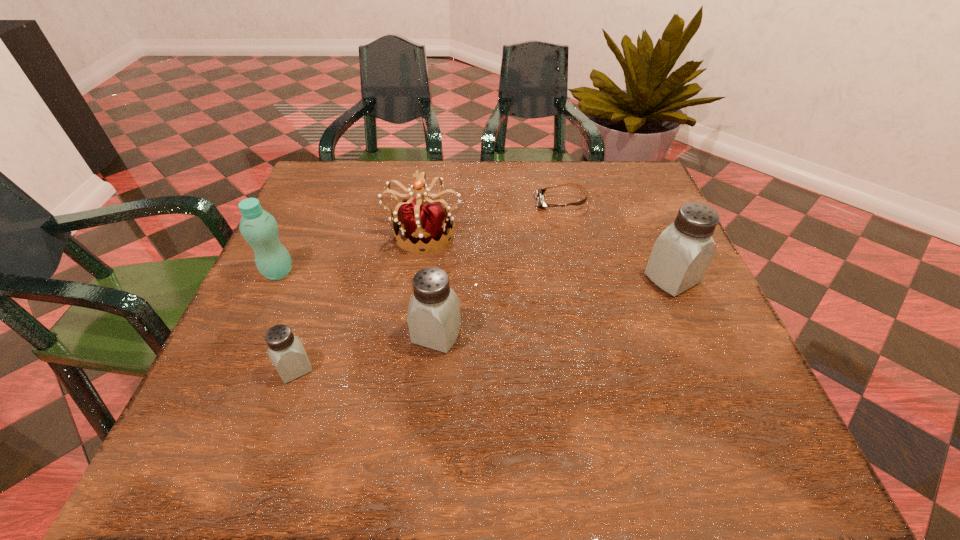
Locate an element on the screen. vacant space at the far right corner of the desktop is located at coordinates 640,177.

Locate an element on the screen. The width and height of the screenshot is (960, 540). vacant space at the near right corner is located at coordinates (745, 404).

This screenshot has width=960, height=540. I want to click on unoccupied position between the tiara and the fifth tallest object, so click(x=360, y=300).

The width and height of the screenshot is (960, 540). I want to click on unoccupied position between the bottle and the fifth tallest object, so click(287, 320).

You are a GUI agent. You are given a task and a screenshot of the screen. Output one action in this format:
    pyautogui.click(x=<x>, y=<y>)
    Task: Click on the free space between the second tallest saltshaker and the fifth object from right to left
    
    Given the screenshot: What is the action you would take?
    pyautogui.click(x=366, y=352)

The image size is (960, 540). Find the location of `free space between the second object from right to left and the rightmost saltshaker`. free space between the second object from right to left and the rightmost saltshaker is located at coordinates (616, 240).

This screenshot has height=540, width=960. Find the location of `free point between the second saltshaker from right to left and the rightmost object`. free point between the second saltshaker from right to left and the rightmost object is located at coordinates (554, 307).

Find the location of a particular element. Image resolution: width=960 pixels, height=540 pixels. free space between the leftmost object and the rightmost object is located at coordinates (475, 275).

Locate an element on the screen. The width and height of the screenshot is (960, 540). blank region between the leftmost object and the leftmost saltshaker is located at coordinates (287, 320).

I want to click on blank region between the rightmost saltshaker and the fifth object from left to right, so click(x=616, y=240).